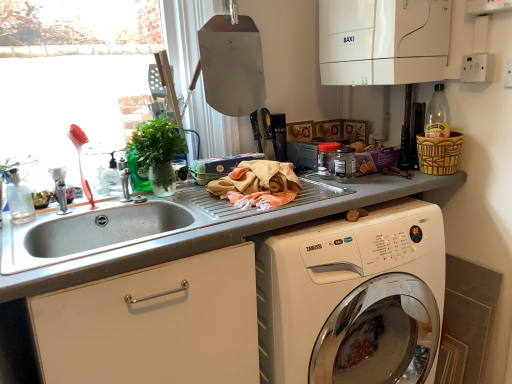
Image resolution: width=512 pixels, height=384 pixels. What do you see at coordinates (439, 154) in the screenshot?
I see `woven brown basket at upper right` at bounding box center [439, 154].

In order to face white glossy washing machine at lower right, should I rotate leftwards or rightwards?

Rotate right and turn 8.111 degrees.

From the picture: How much space does transparent plastic jar at center, the 2th appliance in the bottom-to-top sequence, occupy vertically?

It is 4.53 inches.

In order to click on clear glass bottle at sink left in this screenshot , I will do `click(19, 199)`.

What do you see at coordinates (345, 164) in the screenshot? I see `transparent glass jar at center, which is the third appliance in top-to-bottom order` at bounding box center [345, 164].

The width and height of the screenshot is (512, 384). Find the location of `woven brown basket at upper right`. woven brown basket at upper right is located at coordinates (439, 154).

Consider the image. Can you tell me how much pink plastic brush at left and green leafy plant at upper left differ in facing direction?

There is a 2.44-degree angle between the facing directions of pink plastic brush at left and green leafy plant at upper left.

From the image's perspective, is pink plastic brush at left above green leafy plant at upper left?

Actually, pink plastic brush at left appears below green leafy plant at upper left in the image.

How distant is pink plastic brush at left from green leafy plant at upper left?

pink plastic brush at left and green leafy plant at upper left are 23.51 centimeters apart from each other.

Considering the sizes of pink plastic brush at left and green leafy plant at upper left in the image, is pink plastic brush at left wider or thinner than green leafy plant at upper left?

Considering their sizes, pink plastic brush at left looks slimmer than green leafy plant at upper left.

Is transparent plastic jar at center, which is the second appliance from top to bottom, taller than pink plastic brush at left?

No.

Which of these two, transparent plastic jar at center, the 2th appliance in the bottom-to-top sequence, or pink plastic brush at left, is smaller?

transparent plastic jar at center, the 2th appliance in the bottom-to-top sequence, is smaller.

From a real-world perspective, is transparent plastic jar at center, the 2th appliance in the bottom-to-top sequence, over pink plastic brush at left?

Actually, transparent plastic jar at center, the 2th appliance in the bottom-to-top sequence, is physically below pink plastic brush at left in the real world.

Which point is more distant from viewer, (322, 164) or (88, 199)?

The point (322, 164) is farther.

Is pink plastic brush at left taller or shorter than woven brown basket at upper right?

Considering their sizes, pink plastic brush at left has more height than woven brown basket at upper right.

Is pink plastic brush at left at the right side of woven brown basket at upper right?

In fact, pink plastic brush at left is to the left of woven brown basket at upper right.

Between point (72, 128) and point (428, 172), which one is positioned in front?

Point (72, 128)

What's the angular difference between pink plastic brush at left and transparent glass jar at center, which is the third appliance in top-to-bottom order,'s facing directions?

0.000515 degrees.

Can you confirm if pink plastic brush at left is positioned to the right of transparent glass jar at center, which is the third appliance in top-to-bottom order?

No, pink plastic brush at left is not to the right of transparent glass jar at center, which is the third appliance in top-to-bottom order.

Does pink plastic brush at left touch transparent glass jar at center, which is the third appliance in top-to-bottom order?

pink plastic brush at left and transparent glass jar at center, which is the third appliance in top-to-bottom order, are clearly separated.

From the image's perspective, relative to transparent glass jar at center, acting as the first appliance starting from the bottom, is pink plastic brush at left above or below?

Based on their image positions, pink plastic brush at left is located beneath transparent glass jar at center, acting as the first appliance starting from the bottom.

From the picture: Does white glossy boiler at upper right, the first appliance from the top, have a greater height compared to white glossy washing machine at lower right?

No.

Is white glossy boiler at upper right, the first appliance from the top, surrounding white glossy washing machine at lower right?

Definitely not — white glossy washing machine at lower right is not inside white glossy boiler at upper right, the first appliance from the top.

Which is in front, point (356, 55) or point (300, 270)?

The point (300, 270) is closer.

Is white glossy boiler at upper right, the first appliance from the top, turned away from white glossy washing machine at lower right?

That's not correct — white glossy boiler at upper right, the first appliance from the top, is not looking away from white glossy washing machine at lower right.

From a real-world perspective, does pink plastic brush at left sit lower than white glossy washing machine at lower right?

Actually, pink plastic brush at left is physically above white glossy washing machine at lower right in the real world.

Considering the relative positions of pink plastic brush at left and white glossy washing machine at lower right in the image provided, is pink plastic brush at left to the right of white glossy washing machine at lower right from the viewer's perspective?

No, pink plastic brush at left is not to the right of white glossy washing machine at lower right.

Considering the sizes of objects pink plastic brush at left and white glossy washing machine at lower right in the image provided, who is taller, pink plastic brush at left or white glossy washing machine at lower right?

white glossy washing machine at lower right.

Measure the distance from pink plastic brush at left to white glossy washing machine at lower right.

35.06 inches.

From a real-world perspective, is transparent plastic jar at center, the 2th appliance in the bottom-to-top sequence, beneath white glossy boiler at upper right, the first appliance from the top?

Correct, in the physical world, transparent plastic jar at center, the 2th appliance in the bottom-to-top sequence, is lower than white glossy boiler at upper right, the first appliance from the top.

Could you tell me if transparent plastic jar at center, the 2th appliance in the bottom-to-top sequence, is facing white glossy boiler at upper right, marked as the third appliance in a bottom-to-top arrangement?

No, transparent plastic jar at center, the 2th appliance in the bottom-to-top sequence, does not turn towards white glossy boiler at upper right, marked as the third appliance in a bottom-to-top arrangement.

Does transparent plastic jar at center, which is the second appliance from top to bottom, appear on the right side of white glossy boiler at upper right, marked as the third appliance in a bottom-to-top arrangement?

No.

Is point (327, 146) more distant than point (417, 10)?

Yes, it is behind point (417, 10).

Identify the location of brush below the green leafy plant at upper left (from the image's perspective). (80, 160).

From a real-world perspective, count 2nd appliances downward from the pink plastic brush at left and point to it. Please provide its 2D coordinates.

[(326, 159)]

Looking at the image, which one is located further to transparent plastic jar at center, the 2th appliance in the bottom-to-top sequence, white glossy boiler at upper right, marked as the third appliance in a bottom-to-top arrangement, or clear glass bottle at sink left?

The object further to transparent plastic jar at center, the 2th appliance in the bottom-to-top sequence, is clear glass bottle at sink left.

From the image, which object appears to be nearer to pink plastic brush at left, smooth gray countertop at center or transparent plastic jar at center, which is the second appliance from top to bottom?

Based on the image, smooth gray countertop at center appears to be nearer to pink plastic brush at left.

When comparing their distances from clear glass bottle at sink left, does smooth gray countertop at center or silver metallic faucet at sink left seem closer?

Among the two, silver metallic faucet at sink left is located nearer to clear glass bottle at sink left.

Estimate the real-world distances between objects in this image. Which object is further from transparent plastic jar at center, the 2th appliance in the bottom-to-top sequence, white glossy boiler at upper right, the first appliance from the top, or green leafy plant at upper left?

Based on the image, green leafy plant at upper left appears to be further to transparent plastic jar at center, the 2th appliance in the bottom-to-top sequence.

When comparing their distances from green leafy plant at upper left, does transparent plastic jar at center, the 2th appliance in the bottom-to-top sequence, or white glossy boiler at upper right, the first appliance from the top, seem closer?

The object closer to green leafy plant at upper left is transparent plastic jar at center, the 2th appliance in the bottom-to-top sequence.

Based on their spatial positions, is transparent glass window screen at upper left or silver metallic faucet at sink left further from transparent plastic jar at center, the 2th appliance in the bottom-to-top sequence?

transparent glass window screen at upper left is positioned further to the anchor transparent plastic jar at center, the 2th appliance in the bottom-to-top sequence.

From the picture: From the image, which object appears to be nearer to pink plastic brush at left, silver metallic faucet at sink left or woven brown basket at upper right?

The object closer to pink plastic brush at left is silver metallic faucet at sink left.

Considering their positions, is smooth gray countertop at center positioned closer to clear glass bottle at sink left than white glossy washing machine at lower right?

The object closer to clear glass bottle at sink left is smooth gray countertop at center.

You are a GUI agent. You are given a task and a screenshot of the screen. Output one action in this format:
    pyautogui.click(x=<x>, y=<y>)
    Task: Click on the brush between transparent glass window screen at upper left and transparent glass jar at center, acting as the first appliance starting from the bottom, in the horizontal direction
    
    Given the screenshot: What is the action you would take?
    pyautogui.click(x=80, y=160)

Where is `faucet between transparent glass window screen at upper left and clear glass bottle at sink left in the vertical direction`? The width and height of the screenshot is (512, 384). faucet between transparent glass window screen at upper left and clear glass bottle at sink left in the vertical direction is located at coordinates (60, 189).

Where is `countertop located between pink plastic brush at left and white glossy washing machine at lower right in the left-right direction`? This screenshot has height=384, width=512. countertop located between pink plastic brush at left and white glossy washing machine at lower right in the left-right direction is located at coordinates (222, 233).

The height and width of the screenshot is (384, 512). Identify the location of brush located between silver metallic faucet at sink left and smooth gray countertop at center in the left-right direction. (80, 160).